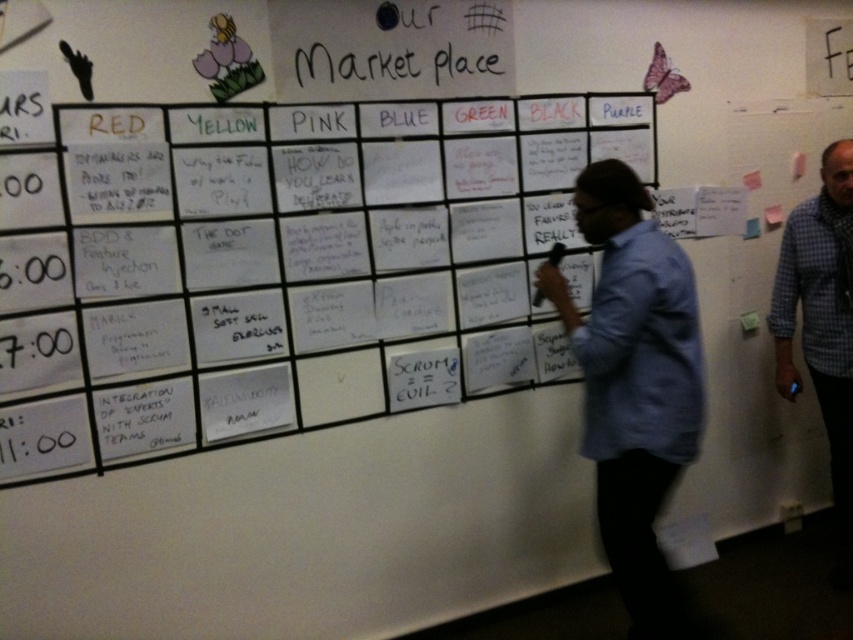
Question: Which object appears closest to the camera in this image?

Choices:
 (A) blue shirt at center
 (B) white paper at center

Answer: (B)

Question: Does white paper at center appear on the left side of blue plaid shirt at right?

Choices:
 (A) no
 (B) yes

Answer: (B)

Question: Based on their relative distances, which object is farther from the white paper at center?

Choices:
 (A) blue plaid shirt at right
 (B) blue shirt at center

Answer: (A)

Question: Which point is closer to the camera?

Choices:
 (A) blue shirt at center
 (B) white paper at center
 (C) blue plaid shirt at right

Answer: (B)

Question: Is white paper at center bigger than blue shirt at center?

Choices:
 (A) no
 (B) yes

Answer: (B)

Question: Considering the relative positions of white paper at center and blue shirt at center in the image provided, where is white paper at center located with respect to blue shirt at center?

Choices:
 (A) right
 (B) left

Answer: (B)